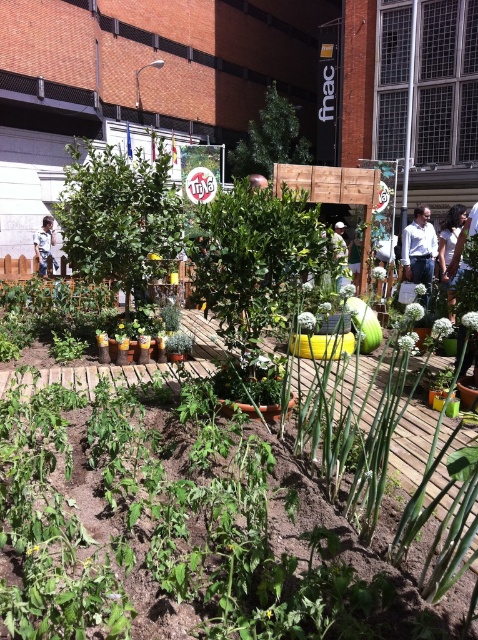
You are standing in the urban garden and notice a person wearing a light blue shirt at upper right. Where would you look to find this person?

The light blue shirt at upper right is located at point (420, 250) in the image, so you should look towards the upper right area near the TriNa banner in the background to find the person.

You are a gardener looking at the urban garden setup. You see a light blue shirt at upper right and a green matte squash at center. Which object is located to the right of the other?

The light blue shirt at upper right is positioned on the right side of green matte squash at center.

You are a photographer standing in the urban garden and want to capture both the dark brown hair at center and the light blue shirt at center in a single frame. Which object should you focus on first to ensure both are in focus?

The dark brown hair at center is shorter than the light blue shirt at center, so you should focus on the light blue shirt at center first to ensure both are in focus.